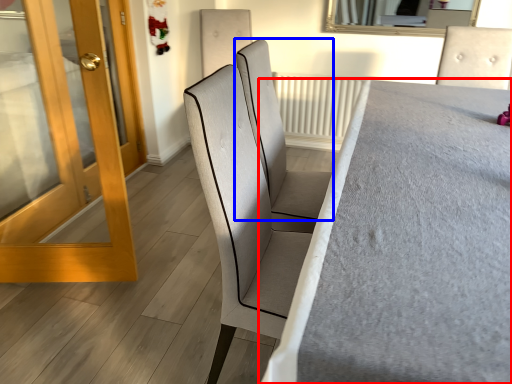
Question: Which object appears closest to the camera in this image, furniture (highlighted by a red box) or chair (highlighted by a blue box)?

Choices:
 (A) furniture
 (B) chair

Answer: (A)